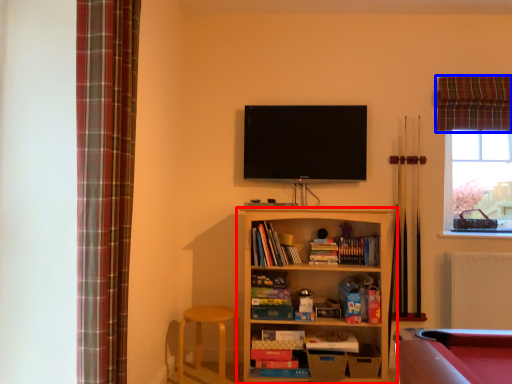
Question: Which object appears farthest to the camera in this image, shelf (highlighted by a red box) or curtain (highlighted by a blue box)?

Choices:
 (A) shelf
 (B) curtain

Answer: (B)